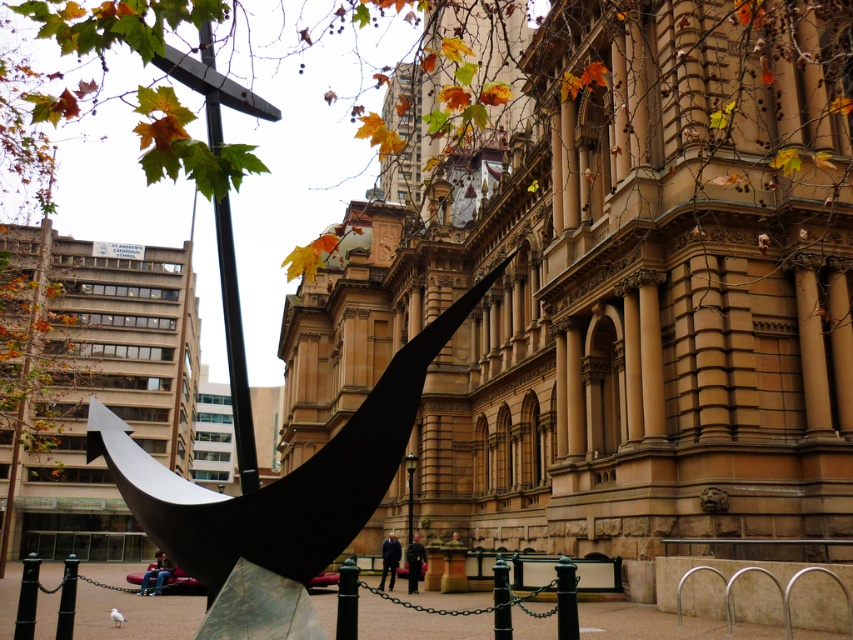
Question: Where is polished black sculpture at center located in relation to metallic pole at center in the image?

Choices:
 (A) below
 (B) above

Answer: (B)

Question: Does metallic pole at upper center appear on the right side of metallic pole at center?

Choices:
 (A) no
 (B) yes

Answer: (A)

Question: Which object is the farthest from the metallic pole at upper center?

Choices:
 (A) black polished pole at center
 (B) polished black sculpture at center

Answer: (B)

Question: Which point is closer to the camera?

Choices:
 (A) (207, 90)
 (B) (231, 282)

Answer: (A)

Question: Can you confirm if metallic pole at upper center is wider than metallic pole at center?

Choices:
 (A) no
 (B) yes

Answer: (B)

Question: Which point is closer to the camera?

Choices:
 (A) metallic pole at upper center
 (B) metallic pole at center

Answer: (A)